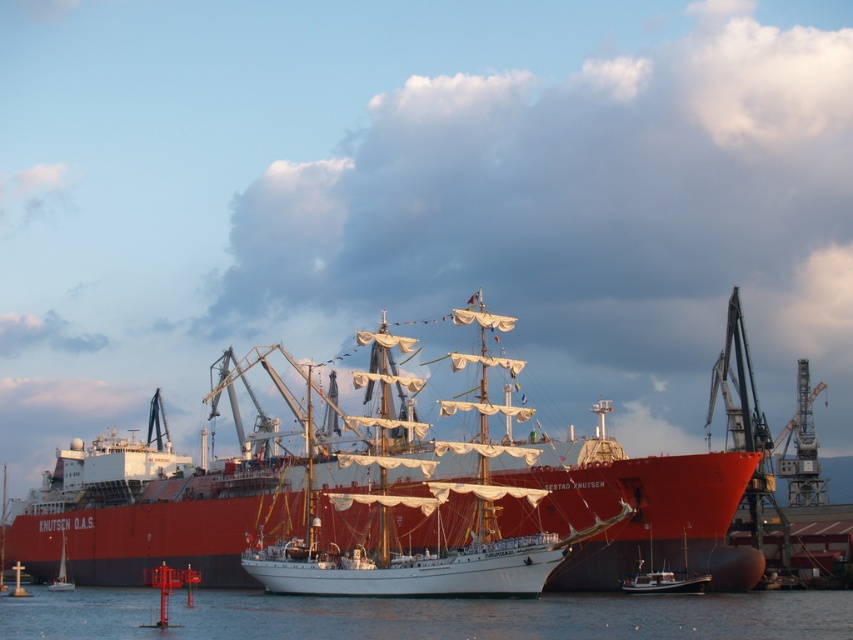
Which of these two, transparent water at lower center or white wooden boat at lower right, stands taller?

transparent water at lower center is taller.

Who is lower down, transparent water at lower center or white wooden boat at lower right?

transparent water at lower center

Identify the location of transparent water at lower center. (426, 616).

Identify the location of smooth white sailboat at center. The width and height of the screenshot is (853, 640). (395, 492).

Does point (376, 492) come behind point (61, 554)?

That is False.

Find the location of `smooth white sailboat at center`. smooth white sailboat at center is located at coordinates (395, 492).

Between transparent water at lower center and white sailboat at lower left, which one has less height?

Standing shorter between the two is white sailboat at lower left.

From the picture: Is transparent water at lower center above white sailboat at lower left?

Yes, transparent water at lower center is above white sailboat at lower left.

The image size is (853, 640). Identify the location of transparent water at lower center. (426, 616).

This screenshot has width=853, height=640. In order to click on transparent water at lower center in this screenshot , I will do `click(426, 616)`.